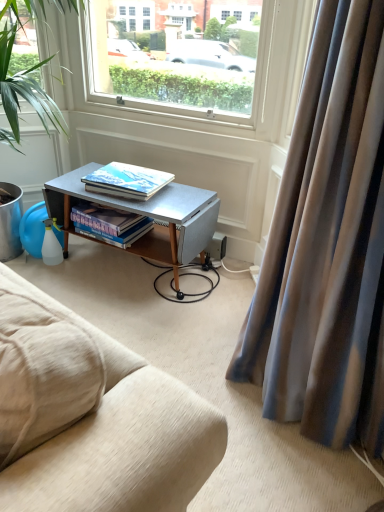
Where is `vacant area that lies between metallic gray desk at center and green leafy plant at left`? Image resolution: width=384 pixels, height=512 pixels. vacant area that lies between metallic gray desk at center and green leafy plant at left is located at coordinates (109, 297).